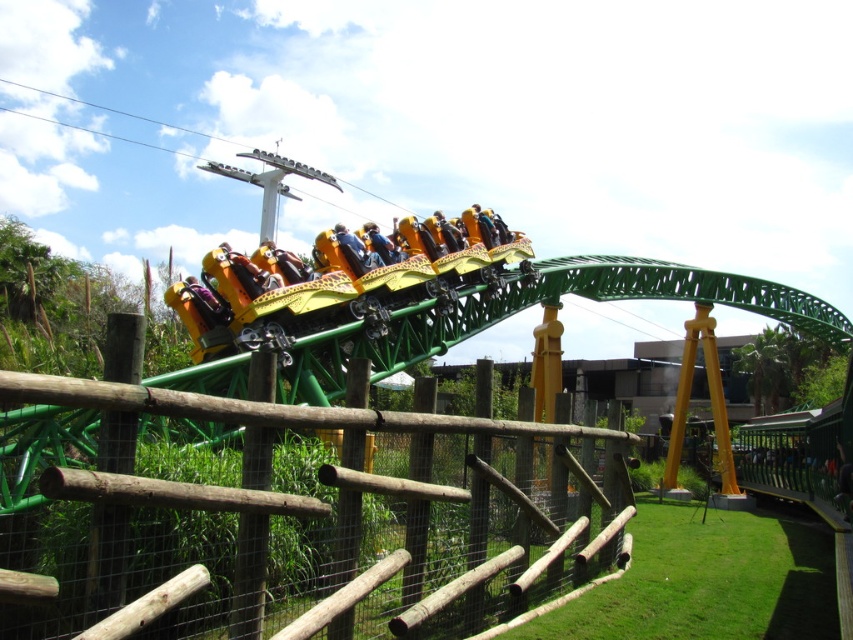
You are a park visitor standing near the wooden fence. You want to take a photo of the yellow leopard print seats at center while avoiding the wooden at center in the frame. Is this possible?

The wooden at center is closer to the viewer than the yellow leopard print seats at center, so it will block the view of the yellow leopard print seats at center. Therefore, you cannot take a photo of the yellow leopard print seats at center without the wooden at center in the frame.

Looking at this image, you are a safety inspector checking the amusement park. You notice the wooden at center and the yellow leopard print seats at center. Which object requires more space for maintenance access? Please explain based on their sizes.

The wooden at center requires more space for maintenance access because it is larger in size than the yellow leopard print seats at center.

What is located at the coordinates point (299, 518) in the image?

The point (299, 518) indicates wooden at center.